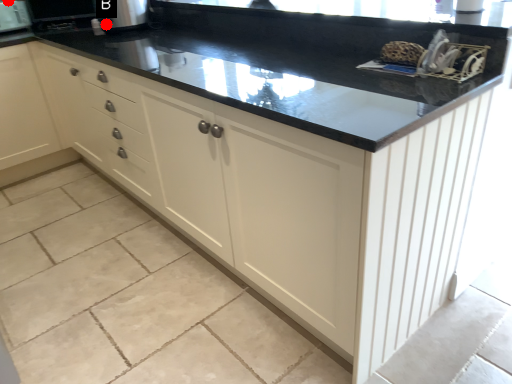
Question: Two points are circled on the image, labeled by A and B beside each circle. Which of the following is the farthest from the observer?

Choices:
 (A) A is further
 (B) B is further

Answer: (A)